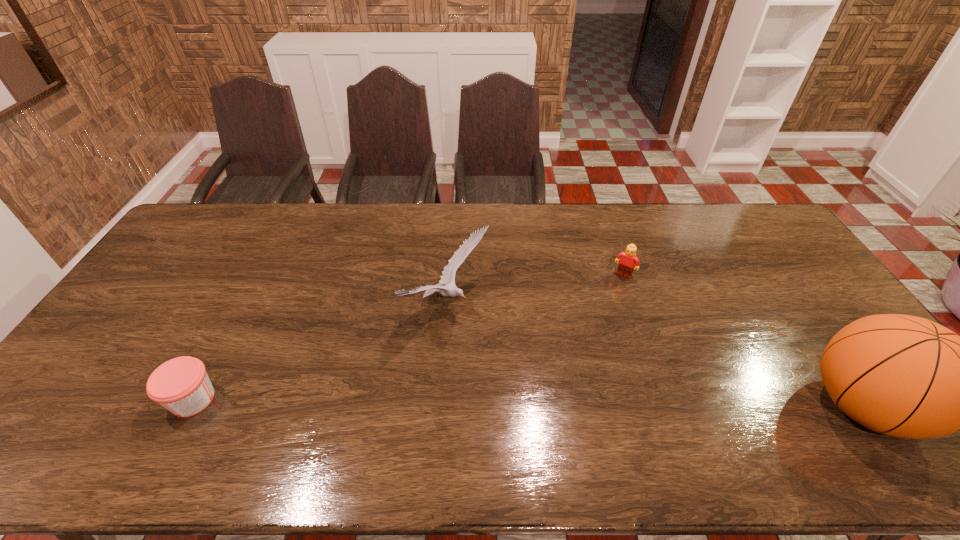
The height and width of the screenshot is (540, 960). What are the coordinates of `vacant space located on the front label of the shortest object` in the screenshot? It's located at (100, 399).

Identify the location of vacant space located on the left of the rightmost object. The image size is (960, 540). (722, 406).

Where is `vacant space situated on the face of the third tallest object`? Image resolution: width=960 pixels, height=540 pixels. vacant space situated on the face of the third tallest object is located at coordinates click(x=604, y=305).

Find the location of a particular element. free space located 0.260m on the face of the third tallest object is located at coordinates (587, 333).

The image size is (960, 540). Find the location of `free location located 0.260m on the face of the third tallest object`. free location located 0.260m on the face of the third tallest object is located at coordinates (587, 333).

The height and width of the screenshot is (540, 960). I want to click on free space located 0.060m at the tip of the beak of the gull, so click(x=496, y=340).

This screenshot has width=960, height=540. I want to click on vacant area situated 0.370m at the tip of the beak of the gull, so click(596, 402).

The height and width of the screenshot is (540, 960). Identify the location of vacant space situated at the tip of the beak of the gull. (520, 355).

Where is `jam that is at the near edge`? jam that is at the near edge is located at coordinates (181, 385).

Identify the location of basketball located in the near edge section of the desktop. (905, 376).